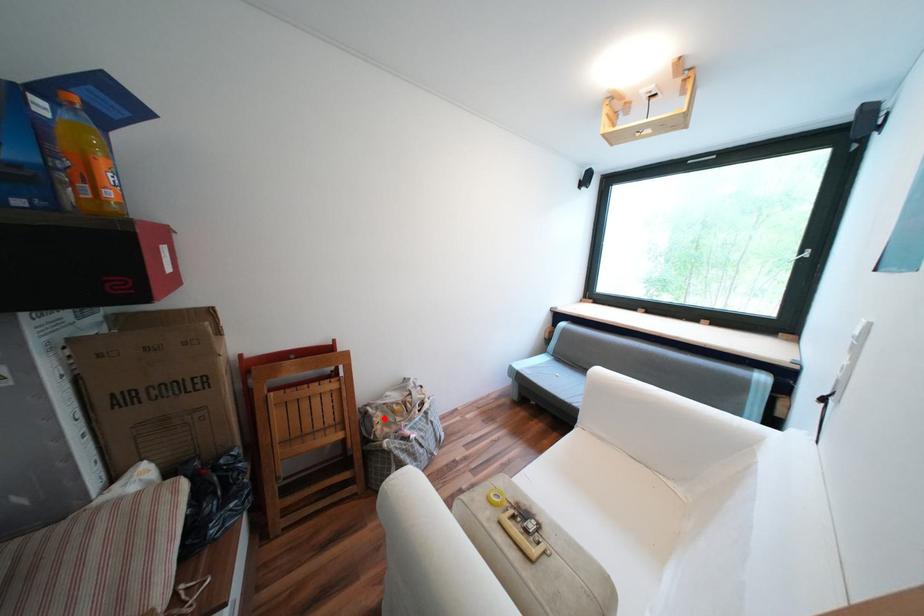
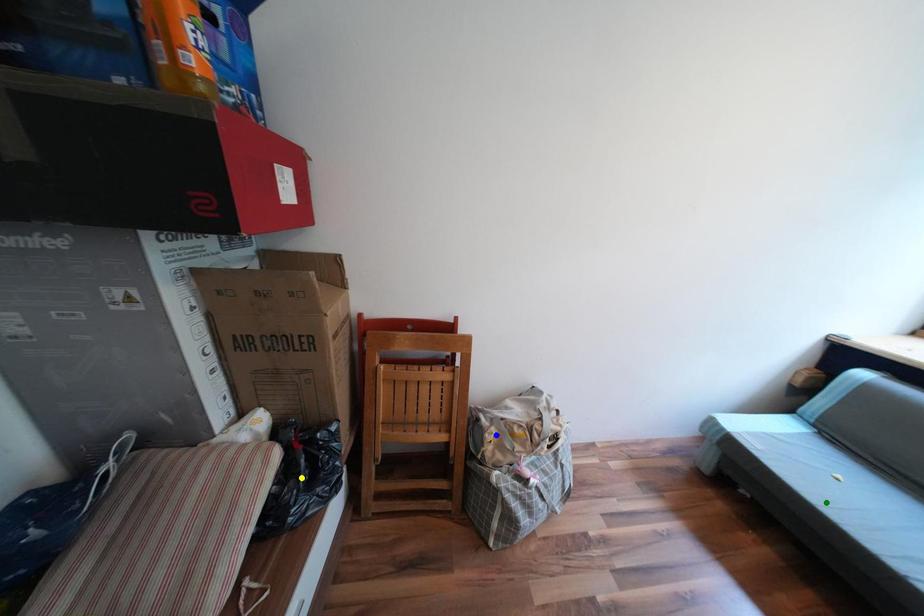
Question: I am providing you with two images of the same scene from different viewpoints. A red point is marked on the first image. You are given multiple points on the second image. In image 2, which mark is for the same physical point as the one in image 1?

Choices:
 (A) green point
 (B) yellow point
 (C) blue point

Answer: (C)